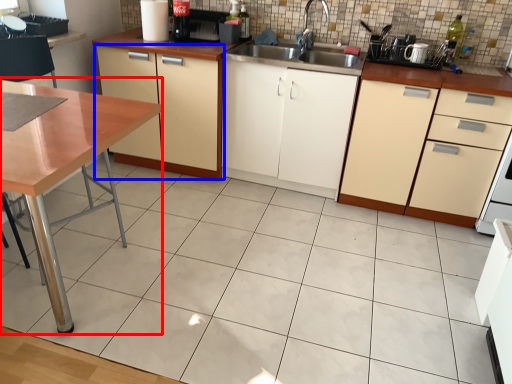
Question: Which object is further to the camera taking this photo, table (highlighted by a red box) or cabinetry (highlighted by a blue box)?

Choices:
 (A) table
 (B) cabinetry

Answer: (B)